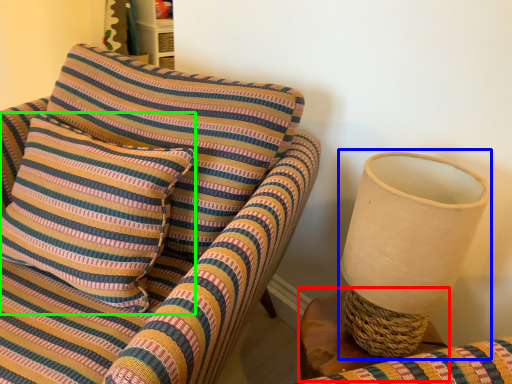
Question: Which is nearer to the table (highlighted by a red box)? table lamp (highlighted by a blue box) or pillow (highlighted by a green box).

Choices:
 (A) table lamp
 (B) pillow

Answer: (A)